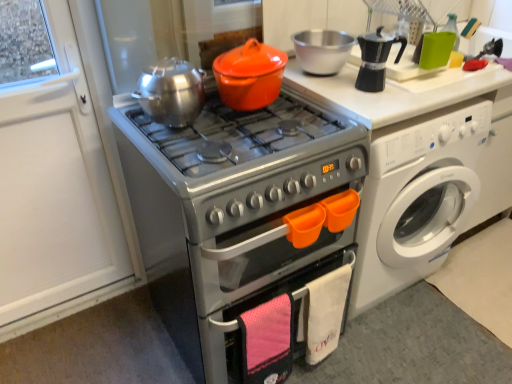
Locate an element on the screen. The width and height of the screenshot is (512, 384). free point above silver metallic oven at center (from a real-world perspective) is located at coordinates (226, 127).